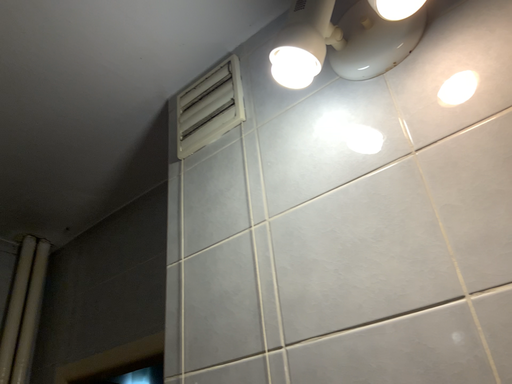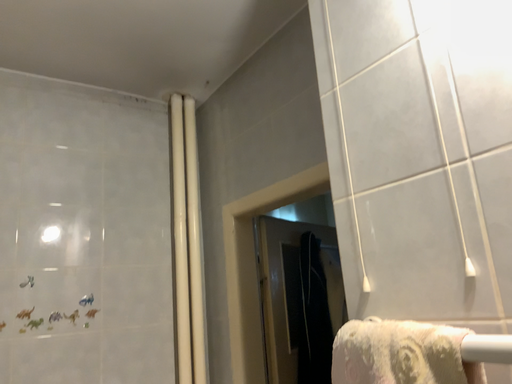
Question: Which way did the camera rotate in the video?

Choices:
 (A) rotated upward
 (B) rotated downward

Answer: (B)